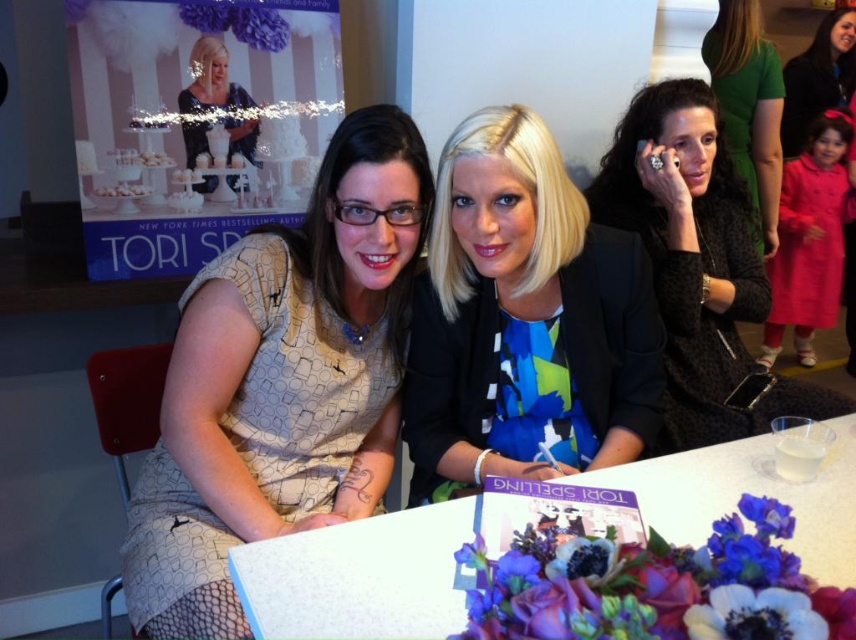
Measure the distance between point (657, 442) and camera.

Point (657, 442) is 5.10 feet away from camera.

Does black textured jacket at upper right appear under matte black dress at upper right?

Yes, black textured jacket at upper right is below matte black dress at upper right.

The width and height of the screenshot is (856, 640). What do you see at coordinates (698, 268) in the screenshot? I see `black textured jacket at upper right` at bounding box center [698, 268].

Locate an element on the screen. The image size is (856, 640). black textured jacket at upper right is located at coordinates (698, 268).

Who is higher up, white textured dress at center or shiny blue dress at center?

shiny blue dress at center is above.

Can you confirm if white textured dress at center is smaller than shiny blue dress at center?

Incorrect, white textured dress at center is not smaller in size than shiny blue dress at center.

Is point (245, 518) positioned before point (211, 67)?

Yes, it is in front of point (211, 67).

I want to click on white textured dress at center, so click(x=281, y=381).

Is white textured dress at center closer to camera compared to blue printed blouse at center?

Yes.

Measure the distance from white textured dress at center to blue printed blouse at center.

A distance of 24.48 centimeters exists between white textured dress at center and blue printed blouse at center.

Describe the element at coordinates (281, 381) in the screenshot. This screenshot has width=856, height=640. I see `white textured dress at center` at that location.

Image resolution: width=856 pixels, height=640 pixels. In order to click on white textured dress at center in this screenshot , I will do `click(281, 381)`.